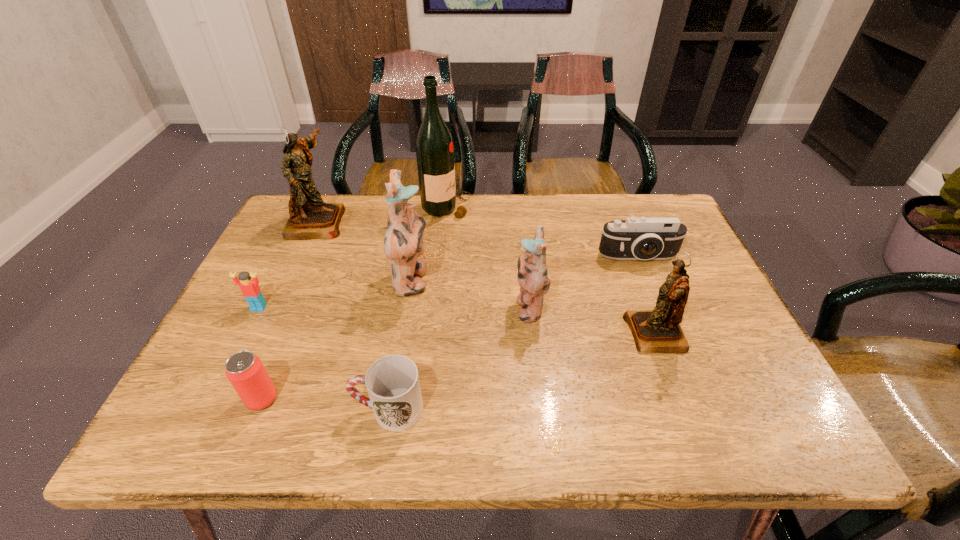
Identify the location of camera. (642, 238).

Where is `red beer can`? red beer can is located at coordinates (245, 371).

This screenshot has height=540, width=960. Identify the location of Lego. (250, 289).

The width and height of the screenshot is (960, 540). Identify the location of red cup. (392, 382).

The image size is (960, 540). I want to click on free space located 0.110m on the surface of the green wine bottle, so click(507, 207).

The height and width of the screenshot is (540, 960). Find the location of `vacant point located 0.270m on the front-facing side of the farthest figurine`. vacant point located 0.270m on the front-facing side of the farthest figurine is located at coordinates (437, 221).

The height and width of the screenshot is (540, 960). Identify the location of free spot located on the front-facing side of the second figurine from left to right. click(473, 282).

Where is `free space located 0.260m on the front-facing side of the rightmost figurine`? Image resolution: width=960 pixels, height=540 pixels. free space located 0.260m on the front-facing side of the rightmost figurine is located at coordinates (512, 334).

Locate an element on the screen. This screenshot has width=960, height=540. free space located on the front-facing side of the rightmost figurine is located at coordinates (498, 334).

Image resolution: width=960 pixels, height=540 pixels. In order to click on vacant region located on the front-facing side of the rightmost figurine in this screenshot , I will do click(458, 334).